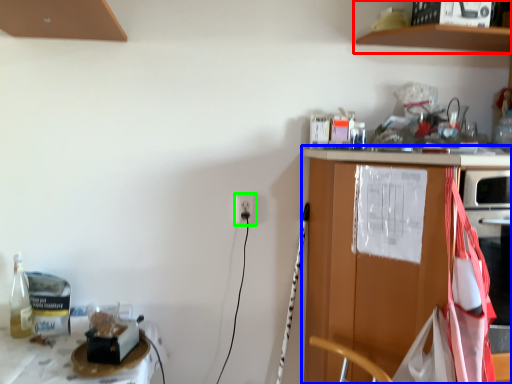
Question: Estimate the real-world distances between objects in this image. Which object is closer to shelf (highlighted by a red box), countertop (highlighted by a blue box) or electric outlet (highlighted by a green box)?

Choices:
 (A) countertop
 (B) electric outlet

Answer: (A)